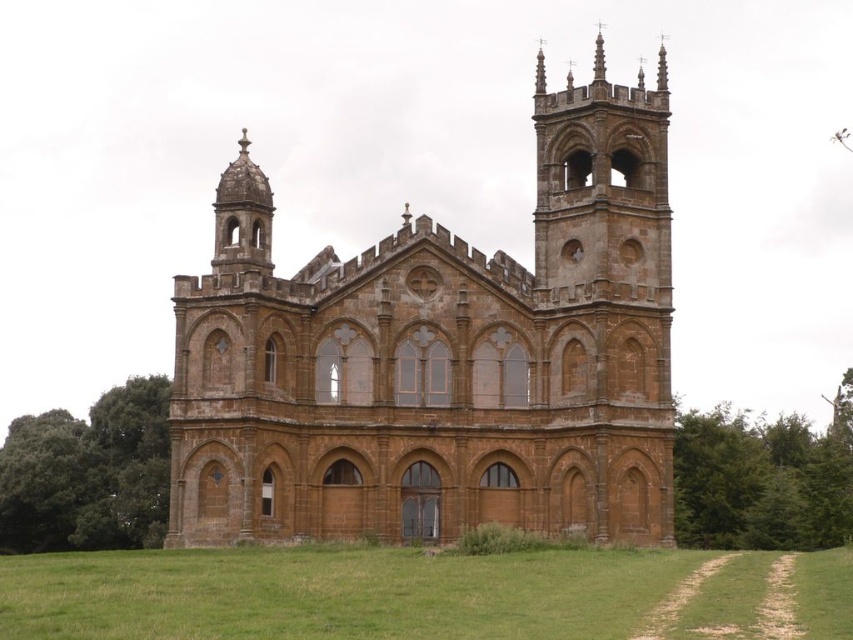
Between brown stone church at center and green grass at lower center, which one is positioned lower?

green grass at lower center

Does brown stone church at center appear under green grass at lower center?

No, brown stone church at center is not below green grass at lower center.

Is point (368, 433) farther from viewer compared to point (664, 564)?

Yes, point (368, 433) is farther from viewer.

Where is `brown stone church at center`? This screenshot has height=640, width=853. brown stone church at center is located at coordinates (440, 356).